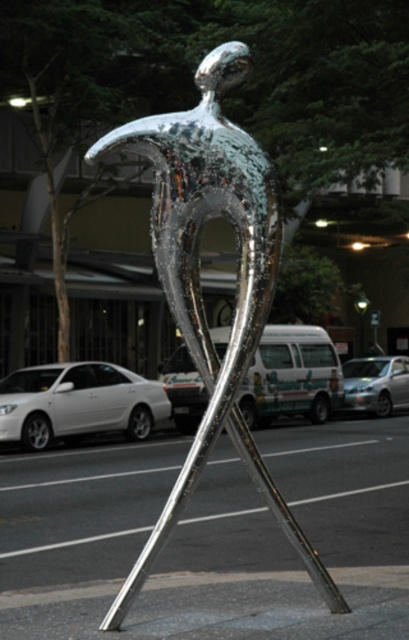
Question: Estimate the real-world distances between objects in this image. Which object is closer to the shiny metallic van at center?

Choices:
 (A) shiny metallic sculpture at center
 (B) silver metallic car at left

Answer: (B)

Question: Based on their relative distances, which object is nearer to the shiny metallic sculpture at center?

Choices:
 (A) shiny metallic van at center
 (B) silver metallic car at left

Answer: (B)

Question: Estimate the real-world distances between objects in this image. Which object is closer to the shiny metallic van at center?

Choices:
 (A) silver metallic car at left
 (B) shiny metallic sculpture at center

Answer: (A)

Question: Can you confirm if shiny metallic sculpture at center is positioned above silver metallic car at left?

Choices:
 (A) yes
 (B) no

Answer: (A)

Question: Does shiny metallic sculpture at center appear on the right side of shiny metallic van at center?

Choices:
 (A) no
 (B) yes

Answer: (A)

Question: Is shiny metallic sculpture at center above shiny metallic van at center?

Choices:
 (A) yes
 (B) no

Answer: (B)